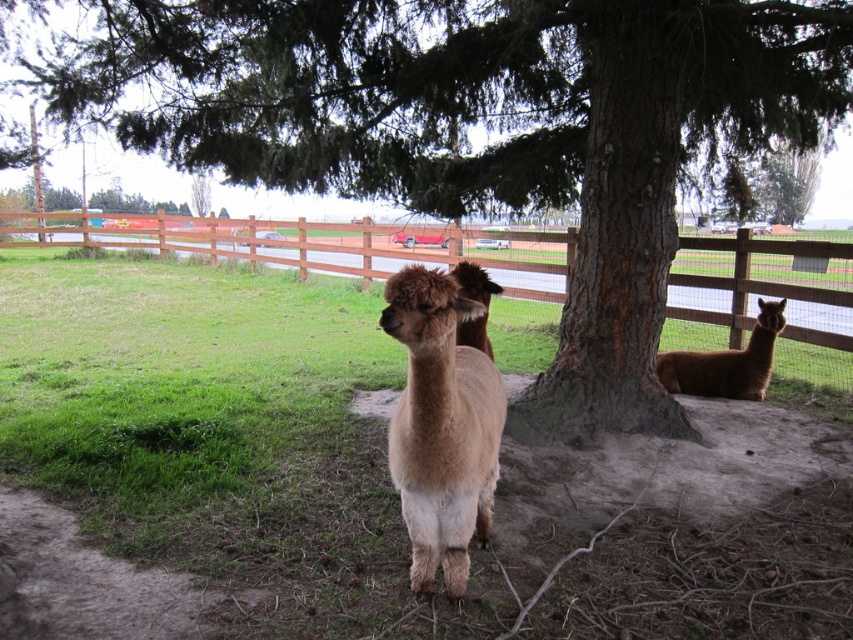
Question: Is brown rough tree at center bigger than brown woolly alpaca at right?

Choices:
 (A) yes
 (B) no

Answer: (A)

Question: Is brown rough tree at center below fuzzy beige alpaca at center?

Choices:
 (A) no
 (B) yes

Answer: (A)

Question: Which object is closer to the camera taking this photo?

Choices:
 (A) brown rough tree at center
 (B) fuzzy beige alpaca at center
 (C) brown woolly alpaca at right
 (D) green grass at lower left

Answer: (B)

Question: Is brown rough tree at center to the left of brown wooden fence at center from the viewer's perspective?

Choices:
 (A) yes
 (B) no

Answer: (B)

Question: Which object appears closest to the camera in this image?

Choices:
 (A) fuzzy brown alpaca at center
 (B) brown wooden fence at center
 (C) fuzzy beige alpaca at center

Answer: (A)

Question: Which object is the closest to the brown rough tree at center?

Choices:
 (A) brown wooden fence at center
 (B) green rough bark tree at upper center
 (C) fuzzy beige alpaca at center
 (D) brown woolly alpaca at right

Answer: (C)